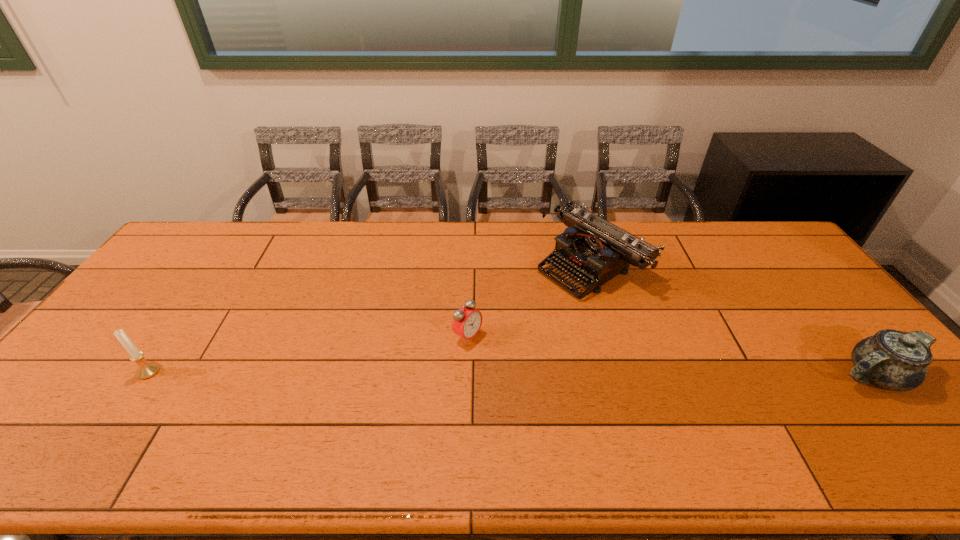
Identify the location of candle holder. (146, 370).

Locate an element on the screen. chinaware is located at coordinates (894, 360).

Find the location of a particular element. The height and width of the screenshot is (540, 960). the second object from left to right is located at coordinates (467, 321).

The width and height of the screenshot is (960, 540). I want to click on the second farthest object, so click(467, 321).

At what (x,y) coordinates should I click in order to perform the action: click on the farthest object. Please return your answer as a coordinate pair (x, y). Looking at the image, I should click on (594, 249).

At what (x,y) coordinates should I click in order to perform the action: click on typewriter. Please return your answer as a coordinate pair (x, y). Looking at the image, I should click on (594, 249).

Find the location of `vacant space located on the right of the candle holder`. vacant space located on the right of the candle holder is located at coordinates click(190, 372).

Find the location of a particular element. vacant area situated 0.290m from the spout of the rightmost object is located at coordinates (717, 375).

The height and width of the screenshot is (540, 960). I want to click on free space located from the spout of the rightmost object, so click(730, 375).

Where is `free space located from the spout of the rightmost object`? The image size is (960, 540). free space located from the spout of the rightmost object is located at coordinates (683, 375).